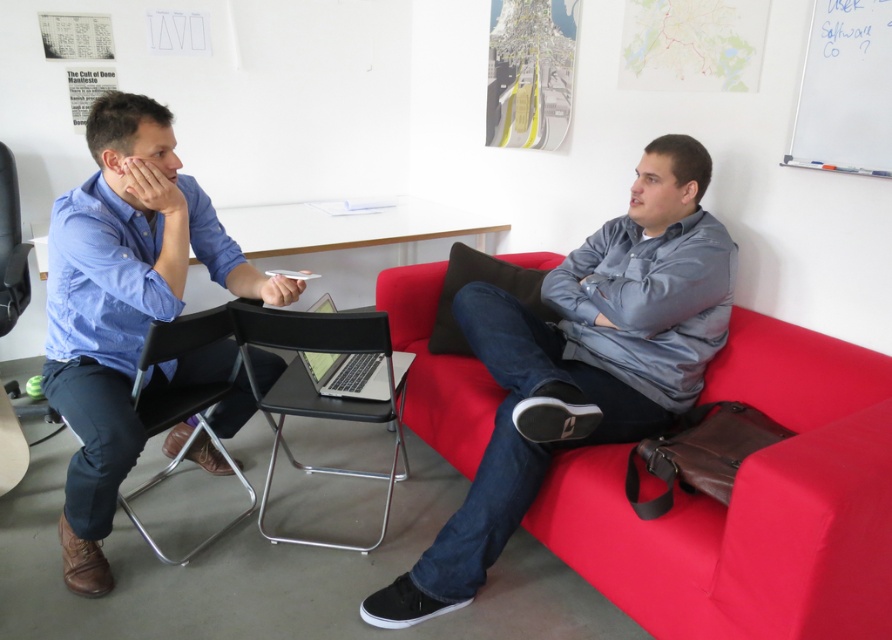
Is black leather chair at left shorter than silver metallic laptop at center?

No, black leather chair at left is not shorter than silver metallic laptop at center.

Is point (164, 388) behind point (325, 296)?

No.

Find the location of a particular element. This screenshot has height=640, width=892. black leather chair at left is located at coordinates (180, 356).

Between black plastic chair at center and black leather chair at left, which one has less height?

black plastic chair at center

Consider the image. Does black plastic chair at center have a larger size compared to black leather chair at left?

No, black plastic chair at center is not bigger than black leather chair at left.

In order to click on black plastic chair at center in this screenshot , I will do [x=314, y=388].

Is the position of blue cotton shirt at left less distant than that of black leather chair at left?

Yes, blue cotton shirt at left is in front of black leather chair at left.

Is blue cotton shirt at left to the left of black leather chair at left from the viewer's perspective?

Correct, you'll find blue cotton shirt at left to the left of black leather chair at left.

This screenshot has width=892, height=640. In order to click on blue cotton shirt at left in this screenshot , I will do `click(122, 305)`.

The width and height of the screenshot is (892, 640). Identify the location of blue cotton shirt at left. (122, 305).